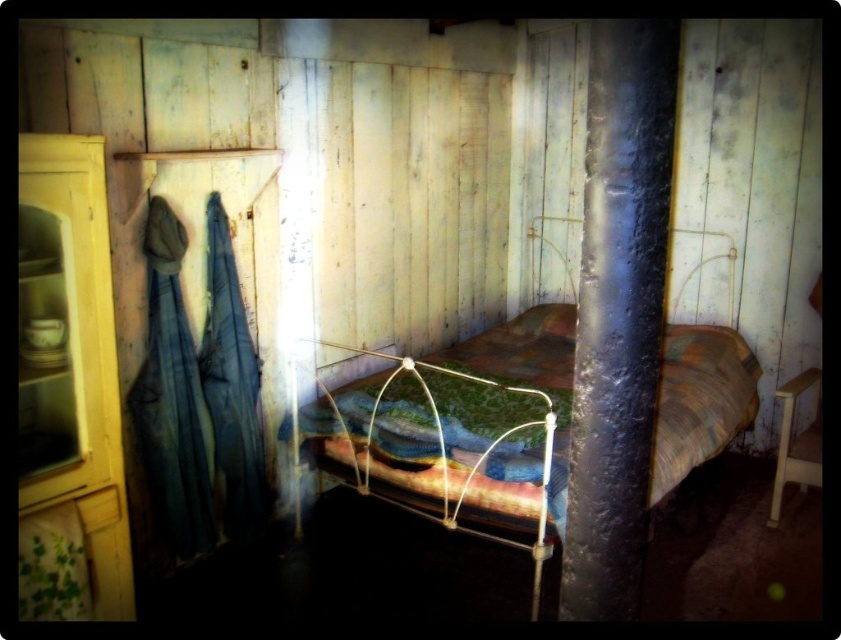
In the scene shown: Can you confirm if rustic wood bed at center is positioned below black rubberized pole at center?

Correct, rustic wood bed at center is located below black rubberized pole at center.

Is rustic wood bed at center in front of black rubberized pole at center?

No, it is not.

At what (x,y) coordinates should I click in order to perform the action: click on rustic wood bed at center. Please return your answer as a coordinate pair (x, y). This screenshot has width=841, height=640. Looking at the image, I should click on (463, 420).

Looking at this image, does rustic wood bed at center have a greater width compared to yellow wood cabinet at left?

Indeed, rustic wood bed at center has a greater width compared to yellow wood cabinet at left.

Does rustic wood bed at center have a lesser width compared to yellow wood cabinet at left?

In fact, rustic wood bed at center might be wider than yellow wood cabinet at left.

Who is more distant from viewer, [704,452] or [36,483]?

The point [704,452] is behind.

This screenshot has height=640, width=841. I want to click on rustic wood bed at center, so click(x=463, y=420).

Can you confirm if black rubberized pole at center is shorter than yellow wood cabinet at left?

Yes, black rubberized pole at center is shorter than yellow wood cabinet at left.

How much distance is there between black rubberized pole at center and yellow wood cabinet at left?

black rubberized pole at center is 5.02 feet from yellow wood cabinet at left.

Which is in front, point (607, 410) or point (104, 573)?

Positioned in front is point (607, 410).

Locate an element on the screen. The image size is (841, 640). black rubberized pole at center is located at coordinates (617, 312).